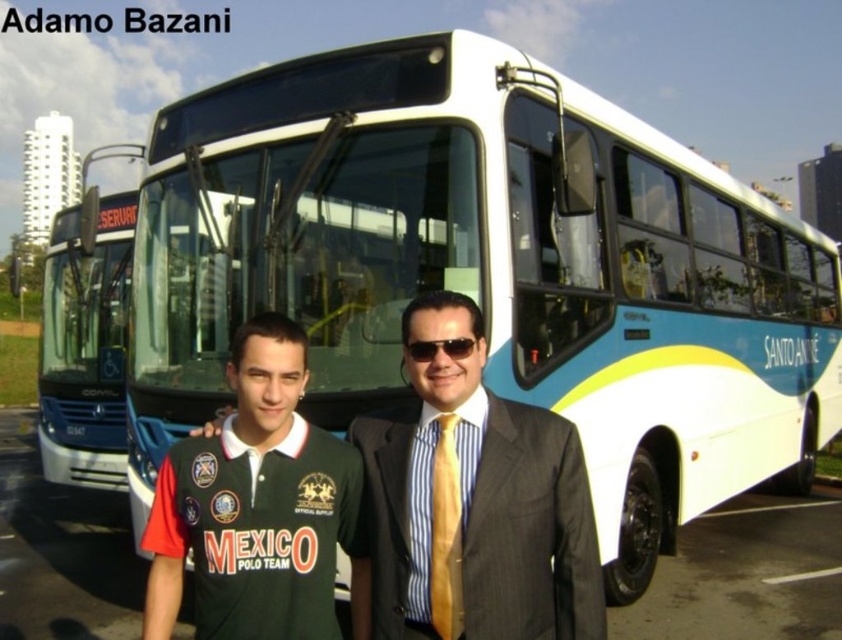
What is the position of the dark gray pinstripe suit at center in the image?

The dark gray pinstripe suit at center is located at point (530, 531).

You are a photographer trying to capture both the dark gray pinstripe suit at center and the white glossy bus at center in a single frame. Based on their sizes, which object should you focus on first to ensure both fit in the frame?

The dark gray pinstripe suit at center has a lesser width compared to the white glossy bus at center, so you should focus on positioning the larger white glossy bus at center first to ensure it fits, then adjust to include the smaller dark gray pinstripe suit at center.